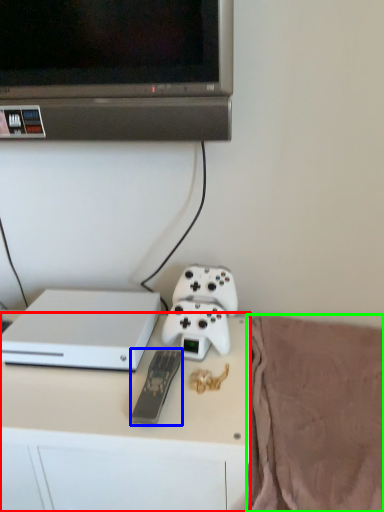
Question: Which object is positioned closest to desk (highlighted by a red box)? Select from remote (highlighted by a blue box) and blanket (highlighted by a green box).

Choices:
 (A) remote
 (B) blanket

Answer: (A)